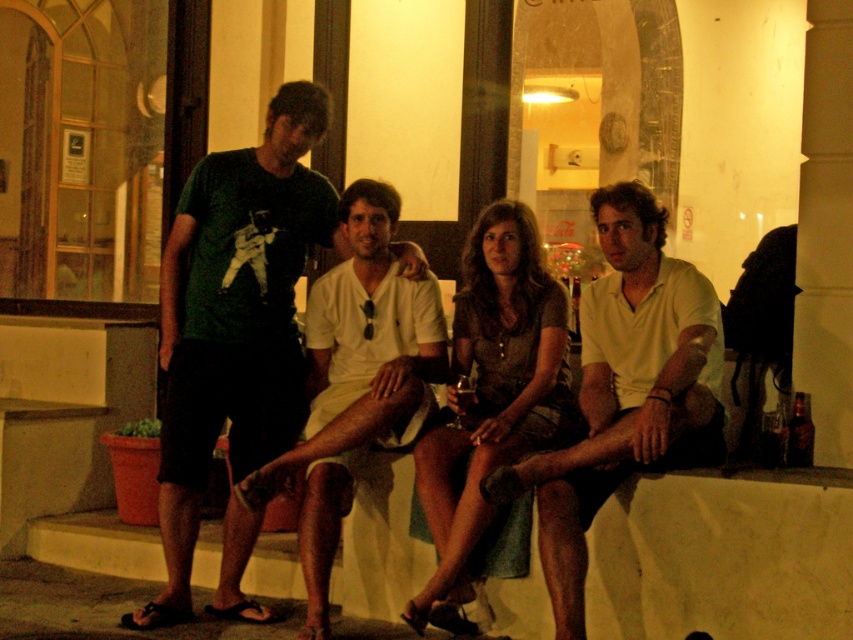
You are a photographer standing at the origin point of the coordinate system in the image. You want to take a photo of the white cotton shirt at center. What are the coordinates where you should aim your camera?

The coordinates to aim your camera are at point (624, 390).

You are standing in front of the image and want to locate the point at coordinates point (235, 320). Which object in the scene does this point lie on?

The point at coordinates point (235, 320) lies on the green matte t shirt at center.

You are a photographer trying to capture a candid shot of the white cotton shirt at center and the matte brown dress at center. Since you want to focus on both subjects equally, would you need to adjust your camera to account for their positions relative to each other?

The white cotton shirt at center is in front of the matte brown dress at center, so to focus on both equally, you might need to adjust the camera to ensure the matte brown dress at center is not too blurred in the background.